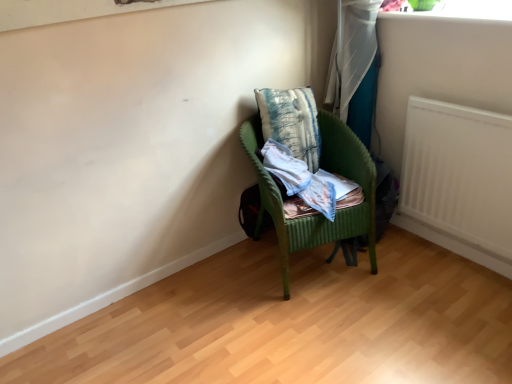
Question: Does textured blue pillow at center appear on the right side of green wicker chair at center?

Choices:
 (A) no
 (B) yes

Answer: (A)

Question: From the image's perspective, is textured blue pillow at center above green wicker chair at center?

Choices:
 (A) yes
 (B) no

Answer: (A)

Question: Does textured blue pillow at center have a smaller size compared to green wicker chair at center?

Choices:
 (A) yes
 (B) no

Answer: (A)

Question: Considering the relative sizes of textured blue pillow at center and green wicker chair at center in the image provided, is textured blue pillow at center wider than green wicker chair at center?

Choices:
 (A) yes
 (B) no

Answer: (B)

Question: Could you tell me if textured blue pillow at center is turned towards green wicker chair at center?

Choices:
 (A) yes
 (B) no

Answer: (A)

Question: Considering the positions of point (309, 196) and point (443, 162), is point (309, 196) closer or farther from the camera than point (443, 162)?

Choices:
 (A) farther
 (B) closer

Answer: (B)

Question: Is light blue cotton shirt at center to the left or to the right of white matte radiator at right in the image?

Choices:
 (A) right
 (B) left

Answer: (B)

Question: From the image's perspective, is light blue cotton shirt at center located above or below white matte radiator at right?

Choices:
 (A) above
 (B) below

Answer: (B)

Question: From their relative heights in the image, would you say light blue cotton shirt at center is taller or shorter than white matte radiator at right?

Choices:
 (A) tall
 (B) short

Answer: (B)

Question: Considering the positions of green wicker chair at center and white fabric curtain at upper right in the image, is green wicker chair at center bigger or smaller than white fabric curtain at upper right?

Choices:
 (A) big
 (B) small

Answer: (A)

Question: Is point (359, 205) closer or farther from the camera than point (364, 72)?

Choices:
 (A) closer
 (B) farther

Answer: (A)

Question: From the image's perspective, relative to white fabric curtain at upper right, is green wicker chair at center above or below?

Choices:
 (A) below
 (B) above

Answer: (A)

Question: From a real-world perspective, is green wicker chair at center above or below white fabric curtain at upper right?

Choices:
 (A) above
 (B) below

Answer: (B)

Question: From a real-world perspective, relative to light blue cotton shirt at center, is white fabric curtain at upper right vertically above or below?

Choices:
 (A) above
 (B) below

Answer: (A)

Question: From the image's perspective, is white fabric curtain at upper right located above or below light blue cotton shirt at center?

Choices:
 (A) below
 (B) above

Answer: (B)